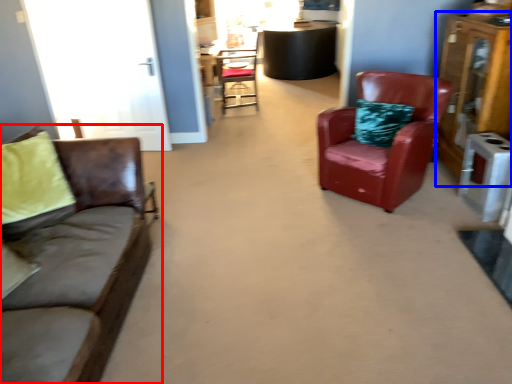
Question: Among these objects, which one is farthest to the camera, studio couch (highlighted by a red box) or dresser (highlighted by a blue box)?

Choices:
 (A) studio couch
 (B) dresser

Answer: (B)